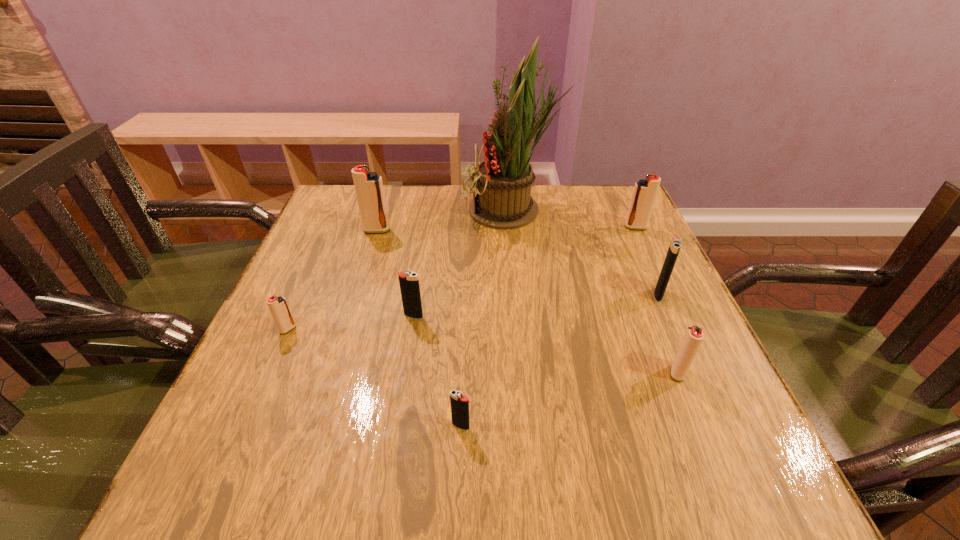
I want to click on flower arrangement, so click(x=504, y=201).

Find the location of `the biggest red igniter`. the biggest red igniter is located at coordinates (369, 190).

Where is `the second tallest object`? Image resolution: width=960 pixels, height=540 pixels. the second tallest object is located at coordinates (369, 190).

This screenshot has height=540, width=960. Identify the location of the rightmost red igniter. (644, 194).

Where is `the fourth farthest object`? This screenshot has height=540, width=960. the fourth farthest object is located at coordinates (675, 245).

At what (x,y) coordinates should I click in order to perform the action: click on the third farthest igniter. Please return your answer as a coordinate pair (x, y). Looking at the image, I should click on (675, 245).

You are a GUI agent. You are given a task and a screenshot of the screen. Output one action in this format:
    pyautogui.click(x=<x>, y=<y>)
    Task: Click on the sixth object from right to left
    
    Given the screenshot: What is the action you would take?
    pyautogui.click(x=409, y=284)

The width and height of the screenshot is (960, 540). What are the coordinates of `the second smallest black igniter` in the screenshot? It's located at (409, 284).

This screenshot has height=540, width=960. I want to click on the third igniter from right to left, so tap(694, 335).

This screenshot has height=540, width=960. Find the location of `the second nearest object`. the second nearest object is located at coordinates (694, 335).